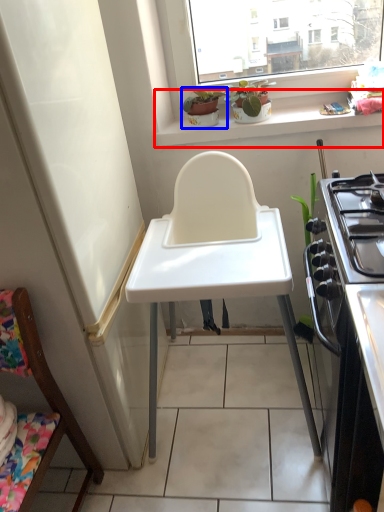
Question: Which object is further to the camera taking this photo, window sill (highlighted by a red box) or houseplant (highlighted by a blue box)?

Choices:
 (A) window sill
 (B) houseplant

Answer: (B)